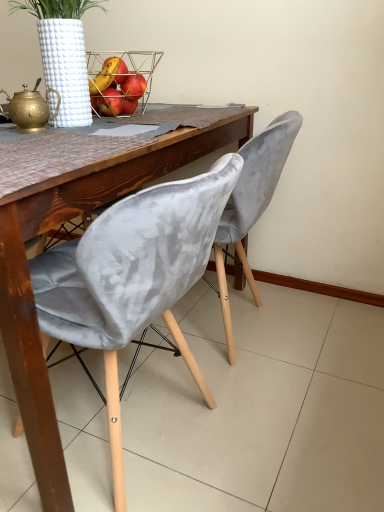
Question: From the image's perspective, would you say velvet grey chair at center, acting as the second chair starting from the front, is shown under velvet grey chair at center, positioned as the second chair in back-to-front order?

Choices:
 (A) no
 (B) yes

Answer: (A)

Question: Considering the relative sizes of velvet grey chair at center, which is the 1th chair in back-to-front order, and velvet grey chair at center, positioned as the second chair in back-to-front order, in the image provided, is velvet grey chair at center, which is the 1th chair in back-to-front order, smaller than velvet grey chair at center, positioned as the second chair in back-to-front order,?

Choices:
 (A) yes
 (B) no

Answer: (A)

Question: Is velvet grey chair at center, which ranks as the 1th chair in front-to-back order, a part of velvet grey chair at center, which is the 1th chair in back-to-front order?

Choices:
 (A) yes
 (B) no

Answer: (B)

Question: Considering the relative sizes of velvet grey chair at center, acting as the second chair starting from the front, and velvet grey chair at center, positioned as the second chair in back-to-front order, in the image provided, is velvet grey chair at center, acting as the second chair starting from the front, shorter than velvet grey chair at center, positioned as the second chair in back-to-front order,?

Choices:
 (A) no
 (B) yes

Answer: (A)

Question: Is velvet grey chair at center, which is the 1th chair in back-to-front order, next to velvet grey chair at center, positioned as the second chair in back-to-front order?

Choices:
 (A) yes
 (B) no

Answer: (B)

Question: Considering the positions of velvet grey chair at center, positioned as the second chair in back-to-front order, and velvet grey chair at center, which is the 1th chair in back-to-front order, in the image, is velvet grey chair at center, positioned as the second chair in back-to-front order, wider or thinner than velvet grey chair at center, which is the 1th chair in back-to-front order,?

Choices:
 (A) thin
 (B) wide

Answer: (B)

Question: Based on their sizes in the image, would you say velvet grey chair at center, which ranks as the 1th chair in front-to-back order, is bigger or smaller than velvet grey chair at center, acting as the second chair starting from the front?

Choices:
 (A) small
 (B) big

Answer: (B)

Question: Is velvet grey chair at center, positioned as the second chair in back-to-front order, inside the boundaries of velvet grey chair at center, acting as the second chair starting from the front, or outside?

Choices:
 (A) outside
 (B) inside

Answer: (A)

Question: Is velvet grey chair at center, positioned as the second chair in back-to-front order, to the left or to the right of velvet grey chair at center, acting as the second chair starting from the front, in the image?

Choices:
 (A) left
 (B) right

Answer: (A)

Question: Visually, is velvet grey chair at center, acting as the second chair starting from the front, positioned to the left or to the right of velvet grey chair at center, positioned as the second chair in back-to-front order?

Choices:
 (A) left
 (B) right

Answer: (B)

Question: Looking at their shapes, would you say velvet grey chair at center, which is the 1th chair in back-to-front order, is wider or thinner than velvet grey chair at center, which ranks as the 1th chair in front-to-back order?

Choices:
 (A) thin
 (B) wide

Answer: (A)

Question: In the image, is velvet grey chair at center, acting as the second chair starting from the front, positioned in front of or behind velvet grey chair at center, which ranks as the 1th chair in front-to-back order?

Choices:
 (A) front
 (B) behind

Answer: (B)

Question: Is velvet grey chair at center, which is the 1th chair in back-to-front order, bigger or smaller than velvet grey chair at center, positioned as the second chair in back-to-front order?

Choices:
 (A) big
 (B) small

Answer: (B)

Question: Is metallic wire basket at upper center in front of or behind velvet grey chair at center, acting as the second chair starting from the front, in the image?

Choices:
 (A) behind
 (B) front

Answer: (A)

Question: Based on their positions, is metallic wire basket at upper center located to the left or right of velvet grey chair at center, acting as the second chair starting from the front?

Choices:
 (A) right
 (B) left

Answer: (B)